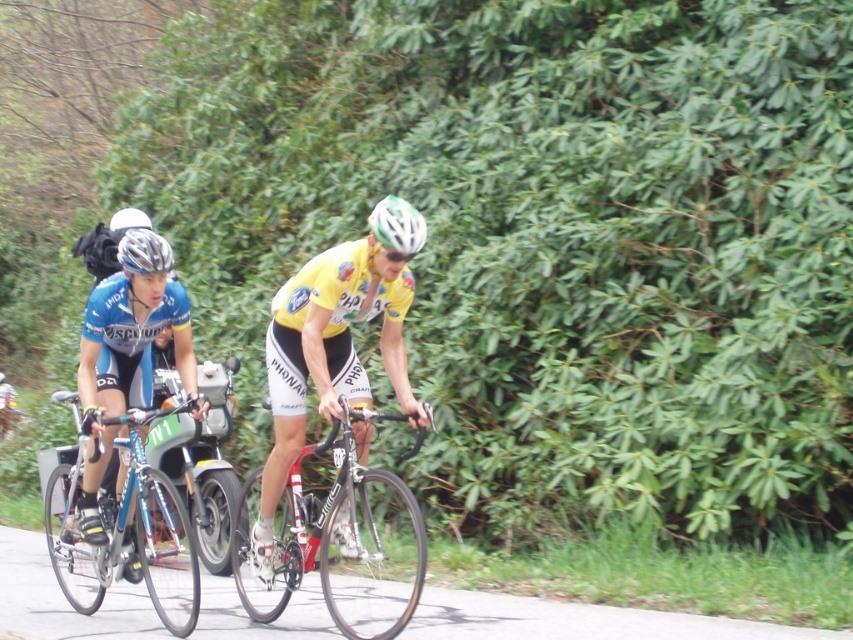
Question: Does yellow jersey at center appear under shiny black frame at center?

Choices:
 (A) no
 (B) yes

Answer: (A)

Question: Among these objects, which one is nearest to the camera?

Choices:
 (A) matte black helmet at left
 (B) green matte bicycle helmet at center
 (C) shiny black frame at center

Answer: (C)

Question: Which point is closer to the camera?

Choices:
 (A) (x=332, y=387)
 (B) (x=140, y=445)
 (C) (x=421, y=435)

Answer: (C)

Question: Is shiny black frame at center closer to camera compared to shiny blue frame at center?

Choices:
 (A) no
 (B) yes

Answer: (B)

Question: Does shiny black frame at center appear under green matte bicycle helmet at center?

Choices:
 (A) no
 (B) yes

Answer: (B)

Question: Estimate the real-world distances between objects in this image. Which object is farther from the blue matte cycling jersey at left?

Choices:
 (A) shiny black frame at center
 (B) green matte bicycle helmet at center
 (C) matte black helmet at left

Answer: (B)